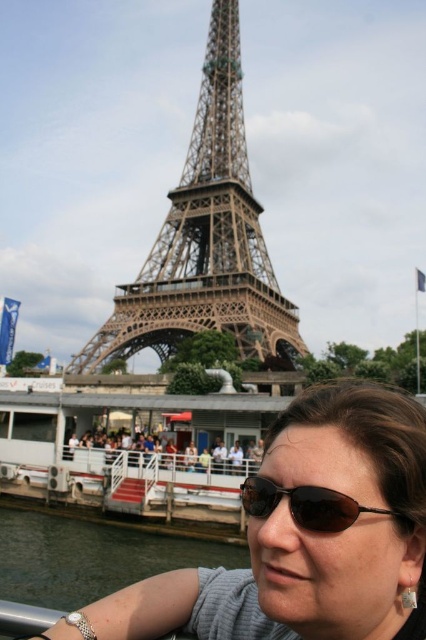
Is matte gray sunglasses at center taller than black plastic sunglasses at lower center?

Yes, matte gray sunglasses at center is taller than black plastic sunglasses at lower center.

Who is positioned more to the right, matte gray sunglasses at center or black plastic sunglasses at lower center?

From the viewer's perspective, matte gray sunglasses at center appears more on the right side.

Is point (282, 612) farther from viewer compared to point (270, 497)?

No, (282, 612) is closer to viewer.

The height and width of the screenshot is (640, 426). Find the location of `matte gray sunglasses at center`. matte gray sunglasses at center is located at coordinates (305, 536).

Can you confirm if matte gray sunglasses at center is thinner than green patina metal eiffel tower at center?

Indeed, matte gray sunglasses at center has a lesser width compared to green patina metal eiffel tower at center.

Which is behind, point (321, 410) or point (221, 227)?

Point (221, 227)

Where is `matte gray sunglasses at center`? The height and width of the screenshot is (640, 426). matte gray sunglasses at center is located at coordinates (305, 536).

Can you confirm if green patina metal eiffel tower at center is smaller than black plastic sunglasses at lower center?

Actually, green patina metal eiffel tower at center might be larger than black plastic sunglasses at lower center.

Measure the distance between point (213, 3) and camera.

Point (213, 3) and camera are 462.78 feet apart.

In order to click on green patina metal eiffel tower at center in this screenshot , I will do `click(206, 240)`.